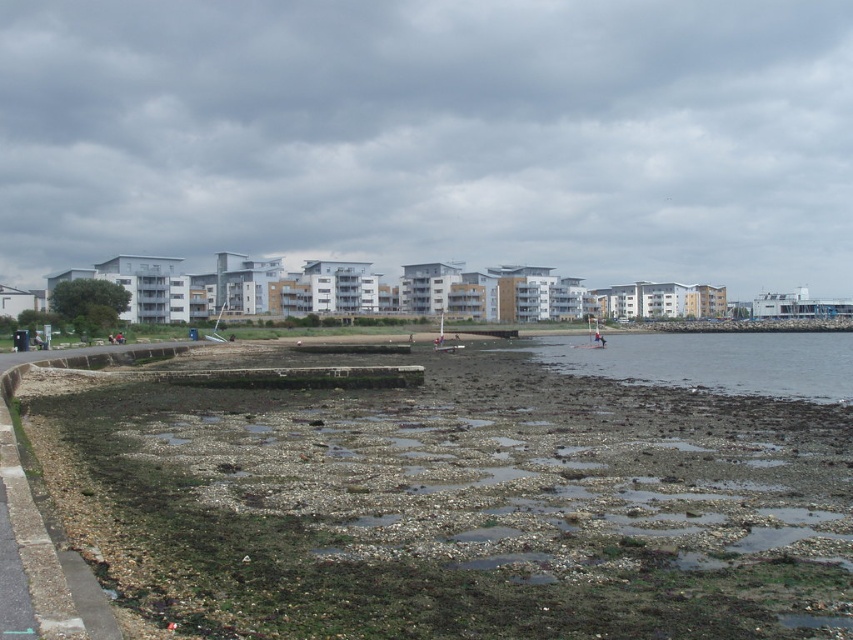
You are standing at the edge of the path and want to reach the rough stone beach at center. Which direction should you walk to get there?

You should walk towards the center to reach the rough stone beach at center.

You are a photographer trying to capture the entire scene of the rough stone beach at center and the brown rocky water at lower center in one shot. Based on their heights, which object will appear larger in the photo?

The rough stone beach at center will appear larger in the photo because it is much taller than the brown rocky water at lower center.

You are standing at the point with coordinates point (785, 336) and want to walk to the point (331, 496). Based on the scene description, which direction should you move relative to your current position?

You should move forward because point (331, 496) is in front of point (785, 336) according to the spatial relationship provided.